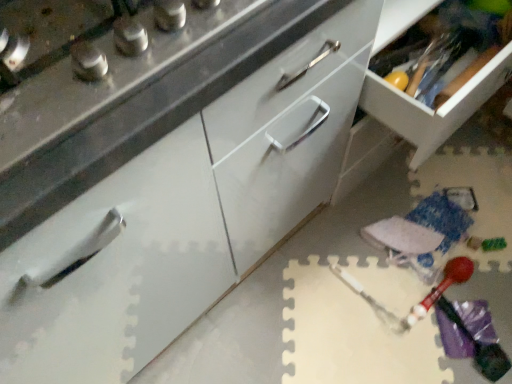
Question: Is point (215, 41) positioned closer to the camera than point (378, 43)?

Choices:
 (A) farther
 (B) closer

Answer: (B)

Question: In terms of height, does matte white drawer at center, marked as the second cabinetry in a right-to-left arrangement, look taller or shorter compared to white glossy drawer at center, the 2th cabinetry viewed from the left?

Choices:
 (A) tall
 (B) short

Answer: (A)

Question: From a real-world perspective, is matte white drawer at center, acting as the first cabinetry starting from the left, positioned above or below white glossy drawer at center, the 2th cabinetry viewed from the left?

Choices:
 (A) above
 (B) below

Answer: (B)

Question: From the image's perspective, is white glossy drawer at center, the 1th cabinetry in the right-to-left sequence, located above or below matte white drawer at center, marked as the second cabinetry in a right-to-left arrangement?

Choices:
 (A) below
 (B) above

Answer: (B)

Question: Is white glossy drawer at center, the 2th cabinetry viewed from the left, in front of or behind matte white drawer at center, acting as the first cabinetry starting from the left, in the image?

Choices:
 (A) behind
 (B) front

Answer: (A)

Question: Based on their positions, is white glossy drawer at center, the 1th cabinetry in the right-to-left sequence, located to the left or right of matte white drawer at center, marked as the second cabinetry in a right-to-left arrangement?

Choices:
 (A) left
 (B) right

Answer: (B)

Question: Which is correct: white glossy drawer at center, the 1th cabinetry in the right-to-left sequence, is inside matte white drawer at center, marked as the second cabinetry in a right-to-left arrangement, or outside of it?

Choices:
 (A) inside
 (B) outside

Answer: (B)